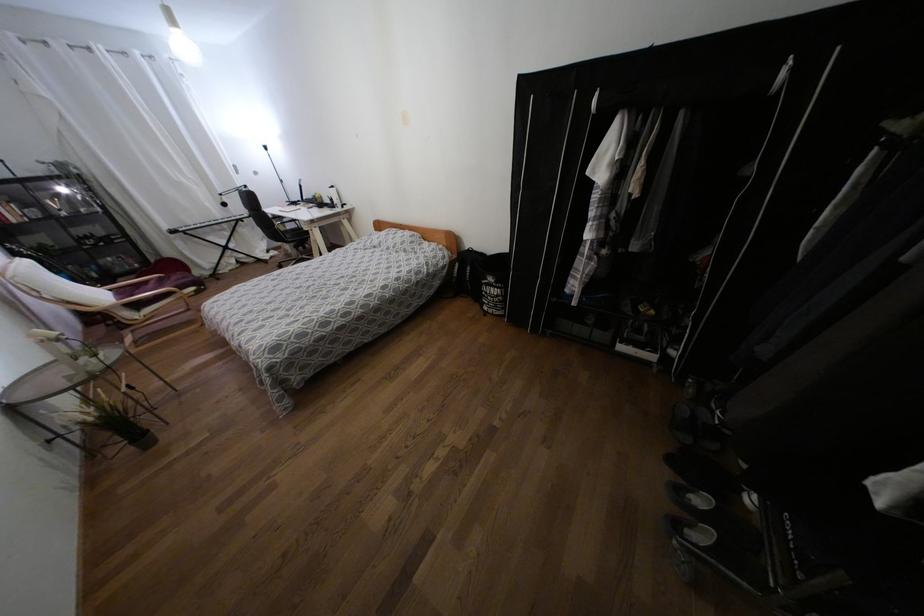
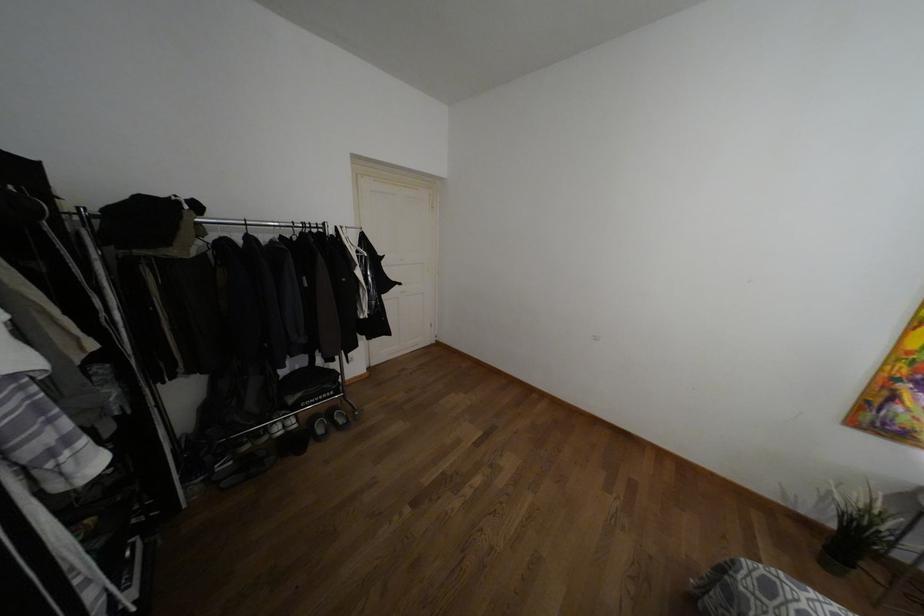
Locate, in the second image, the point that corresponds to point (274, 347) in the first image.

(769, 588)